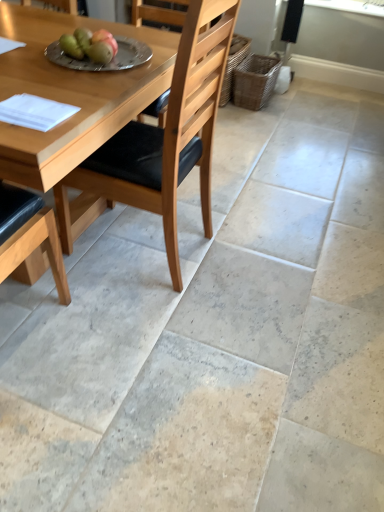
This screenshot has height=512, width=384. I want to click on free region under white paper at lower left (from a real-world perspective), so click(x=34, y=109).